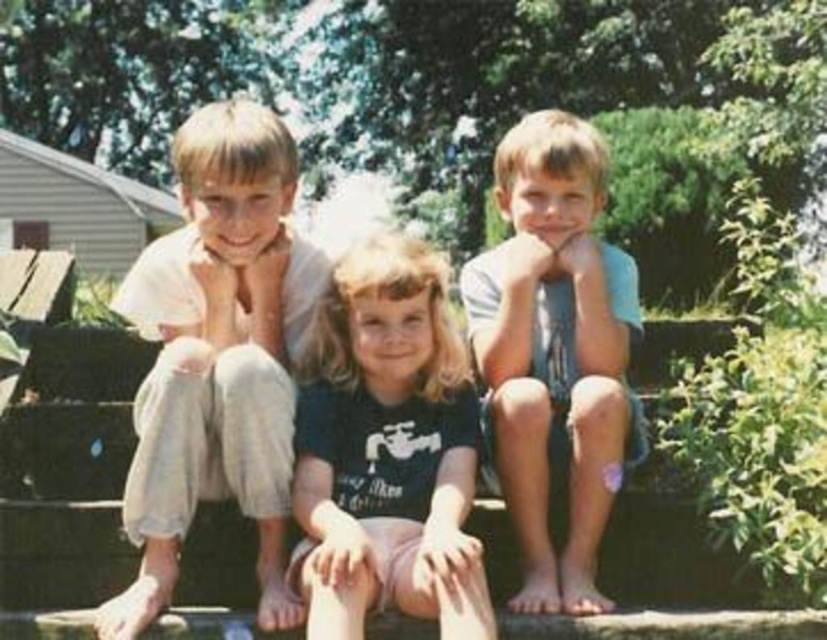
Between light beige cotton shirt at left and black cotton shirt at center, which one is positioned lower?

black cotton shirt at center

Which is behind, point (264, 244) or point (335, 397)?

Point (264, 244)

Which is in front, point (254, 429) or point (428, 403)?

Point (254, 429) is in front.

Where is `light beige cotton shirt at left`? The width and height of the screenshot is (827, 640). light beige cotton shirt at left is located at coordinates (218, 356).

Can you confirm if light beige cotton shirt at left is wider than light blue denim shorts at center?

Yes.

From the picture: Between light beige cotton shirt at left and light blue denim shorts at center, which one appears on the right side from the viewer's perspective?

light blue denim shorts at center

Between point (233, 253) and point (477, 326), which one is positioned behind?

Positioned behind is point (477, 326).

Locate an element on the screen. The image size is (827, 640). light beige cotton shirt at left is located at coordinates (218, 356).

Who is positioned more to the left, black cotton shirt at center or light blue denim shorts at center?

From the viewer's perspective, black cotton shirt at center appears more on the left side.

Who is more distant from viewer, (383, 586) or (617, 273)?

The point (617, 273) is behind.

You are a GUI agent. You are given a task and a screenshot of the screen. Output one action in this format:
    pyautogui.click(x=<x>, y=<y>)
    Task: Click on the black cotton shirt at center
    
    Given the screenshot: What is the action you would take?
    pyautogui.click(x=386, y=451)